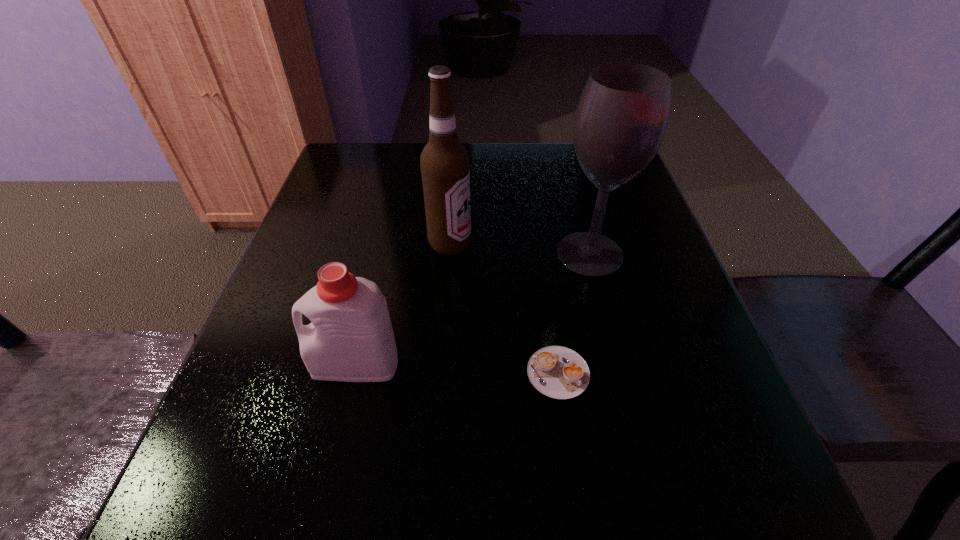
The image size is (960, 540). What are the coordinates of `the left alcohol` in the screenshot? It's located at (445, 165).

Identify the location of the right alcohol. (621, 118).

At what (x,y) coordinates should I click in order to perform the action: click on the leftmost object. Please return your answer as a coordinate pair (x, y). The width and height of the screenshot is (960, 540). Looking at the image, I should click on (351, 339).

Locate an element on the screen. This screenshot has height=540, width=960. the second shortest object is located at coordinates (351, 339).

The image size is (960, 540). Identify the location of the shortest object. (558, 372).

Locate an element on the screen. The width and height of the screenshot is (960, 540). blank area located 0.290m on the label of the second object from left to right is located at coordinates (603, 244).

Where is `vacant space located 0.300m on the left of the right alcohol`? The width and height of the screenshot is (960, 540). vacant space located 0.300m on the left of the right alcohol is located at coordinates (415, 254).

The image size is (960, 540). I want to click on free spot located 0.120m on the handle side of the detergent, so click(x=242, y=364).

I want to click on free space located on the handle side of the detergent, so click(253, 364).

Where is `vacant region located on the handle side of the detergent`? This screenshot has height=540, width=960. vacant region located on the handle side of the detergent is located at coordinates (248, 364).